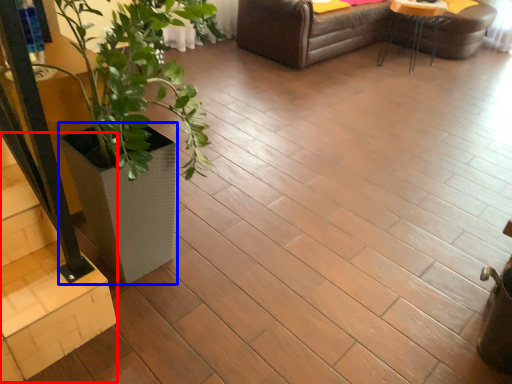
Question: Which point is closer to the camera, stairwell (highlighted by a red box) or flowerpot (highlighted by a blue box)?

Choices:
 (A) stairwell
 (B) flowerpot

Answer: (A)